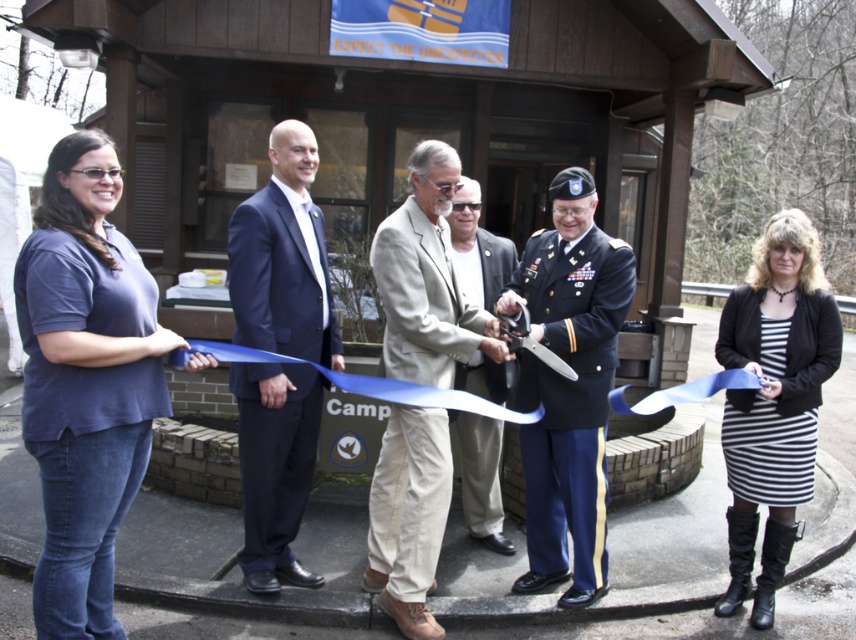
Question: Does shiny blue uniform at center have a lesser width compared to light brown leather jacket at center?

Choices:
 (A) yes
 (B) no

Answer: (B)

Question: Which point appears farthest from the camera in this image?

Choices:
 (A) (608, 390)
 (B) (248, 520)
 (C) (742, 369)

Answer: (B)

Question: Which point is farther from the camera taking this photo?

Choices:
 (A) (299, 166)
 (B) (773, 509)
 (C) (391, 596)
 (D) (666, 394)

Answer: (B)

Question: Which point appears farthest from the camera in this image?

Choices:
 (A) (646, 400)
 (B) (418, 410)
 (C) (500, 384)
 (D) (274, 224)

Answer: (C)

Question: Can you confirm if beige cotton blazer at center is thinner than light brown leather jacket at center?

Choices:
 (A) no
 (B) yes

Answer: (A)

Question: Is shiny blue uniform at center above blue satin ribbon at center?

Choices:
 (A) no
 (B) yes

Answer: (A)